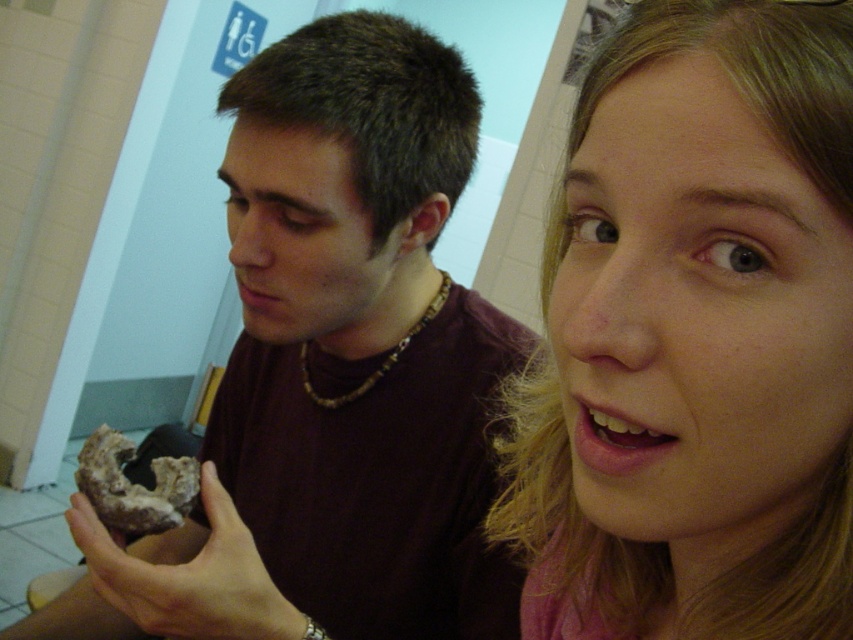
Question: Does blonde hair at upper right have a lesser width compared to chocolate glazed donut at lower left?

Choices:
 (A) no
 (B) yes

Answer: (B)

Question: Which point is closer to the camera?

Choices:
 (A) blonde hair at upper right
 (B) brown textured mushroom at lower left
 (C) chocolate glazed donut at lower left
 (D) matte brown donut at center

Answer: (A)

Question: Does matte brown donut at center have a lesser width compared to chocolate glazed donut at lower left?

Choices:
 (A) no
 (B) yes

Answer: (A)

Question: Which point is closer to the camera taking this photo?

Choices:
 (A) (483, 627)
 (B) (831, 216)
 (C) (206, 627)

Answer: (B)

Question: Does blonde hair at upper right appear under brown textured mushroom at lower left?

Choices:
 (A) yes
 (B) no

Answer: (B)

Question: Which object appears closest to the camera in this image?

Choices:
 (A) blonde hair at upper right
 (B) brown textured mushroom at lower left
 (C) matte brown donut at center

Answer: (A)